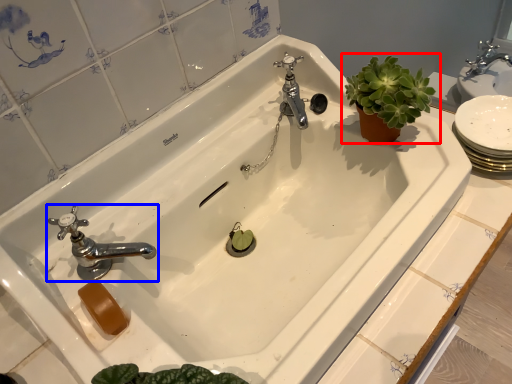
Question: Which of the following is the closest to the observer, houseplant (highlighted by a red box) or tap (highlighted by a blue box)?

Choices:
 (A) houseplant
 (B) tap

Answer: (B)